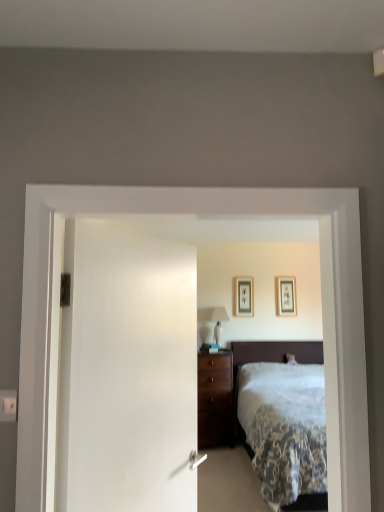
Question: Is white plastic electric outlet at lower left to the right of white glossy table lamp at center from the viewer's perspective?

Choices:
 (A) yes
 (B) no

Answer: (B)

Question: Is white glossy table lamp at center surrounded by white plastic electric outlet at lower left?

Choices:
 (A) yes
 (B) no

Answer: (B)

Question: Is white glossy table lamp at center at the back of white plastic electric outlet at lower left?

Choices:
 (A) yes
 (B) no

Answer: (B)

Question: Is white plastic electric outlet at lower left not inside white glossy table lamp at center?

Choices:
 (A) no
 (B) yes

Answer: (B)

Question: Does white plastic electric outlet at lower left have a smaller size compared to white glossy table lamp at center?

Choices:
 (A) no
 (B) yes

Answer: (B)

Question: Does point (8, 399) appear closer or farther from the camera than point (289, 289)?

Choices:
 (A) farther
 (B) closer

Answer: (B)

Question: Do you think white plastic electric outlet at lower left is within matte black picture frame at upper center, placed as the second picture frame when sorted from left to right, or outside of it?

Choices:
 (A) outside
 (B) inside

Answer: (A)

Question: Is white plastic electric outlet at lower left in front of or behind matte black picture frame at upper center, placed as the second picture frame when sorted from left to right, in the image?

Choices:
 (A) behind
 (B) front

Answer: (B)

Question: From a real-world perspective, relative to matte black picture frame at upper center, placed as the second picture frame when sorted from left to right, is white plastic electric outlet at lower left vertically above or below?

Choices:
 (A) below
 (B) above

Answer: (A)

Question: From a real-world perspective, is matte black picture frame at center, which is the 1th picture frame in left-to-right order, physically located above or below white soft bed at center?

Choices:
 (A) below
 (B) above

Answer: (B)

Question: Based on their positions, is matte black picture frame at center, which ranks as the 2th picture frame in right-to-left order, located to the left or right of white soft bed at center?

Choices:
 (A) right
 (B) left

Answer: (B)

Question: From the image's perspective, is matte black picture frame at center, which is the 1th picture frame in left-to-right order, located above or below white soft bed at center?

Choices:
 (A) above
 (B) below

Answer: (A)

Question: Looking at their shapes, would you say matte black picture frame at center, which ranks as the 2th picture frame in right-to-left order, is wider or thinner than white soft bed at center?

Choices:
 (A) wide
 (B) thin

Answer: (B)

Question: Is point (221, 336) closer or farther from the camera than point (249, 294)?

Choices:
 (A) farther
 (B) closer

Answer: (B)

Question: From a real-world perspective, is white glossy table lamp at center positioned above or below matte black picture frame at center, which ranks as the 2th picture frame in right-to-left order?

Choices:
 (A) below
 (B) above

Answer: (A)